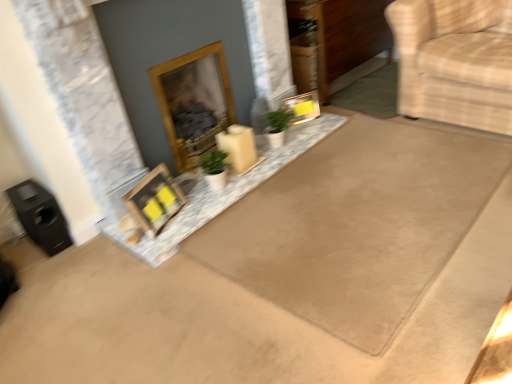
Question: Is beige fabric armchair at right outside wooden fireplace at center?

Choices:
 (A) yes
 (B) no

Answer: (A)

Question: Is beige fabric armchair at right at the left side of wooden fireplace at center?

Choices:
 (A) yes
 (B) no

Answer: (B)

Question: Would you consider beige fabric armchair at right to be distant from wooden fireplace at center?

Choices:
 (A) yes
 (B) no

Answer: (A)

Question: Does beige fabric armchair at right appear on the right side of wooden fireplace at center?

Choices:
 (A) no
 (B) yes

Answer: (B)

Question: From the image's perspective, is beige fabric armchair at right below wooden fireplace at center?

Choices:
 (A) yes
 (B) no

Answer: (B)

Question: Is beige fabric armchair at right oriented away from wooden fireplace at center?

Choices:
 (A) yes
 (B) no

Answer: (B)

Question: Is beige fabric armchair at right looking in the opposite direction of beige carpet at upper right, positioned as the 1th doormat in right-to-left order?

Choices:
 (A) no
 (B) yes

Answer: (A)

Question: Does beige fabric armchair at right have a lesser width compared to beige carpet at upper right, positioned as the 1th doormat in right-to-left order?

Choices:
 (A) no
 (B) yes

Answer: (A)

Question: Does beige fabric armchair at right come in front of beige carpet at upper right, which is the 2th doormat in left-to-right order?

Choices:
 (A) yes
 (B) no

Answer: (A)

Question: From a real-world perspective, is beige fabric armchair at right over beige carpet at upper right, positioned as the 1th doormat in right-to-left order?

Choices:
 (A) yes
 (B) no

Answer: (A)

Question: Does beige fabric armchair at right have a lesser height compared to beige carpet at upper right, which is the 2th doormat in left-to-right order?

Choices:
 (A) yes
 (B) no

Answer: (B)

Question: Is beige fabric armchair at right not near beige carpet at upper right, positioned as the 1th doormat in right-to-left order?

Choices:
 (A) yes
 (B) no

Answer: (B)

Question: From the image's perspective, is beige carpet at upper right, which is the 2th doormat in left-to-right order, above beige fabric armchair at right?

Choices:
 (A) no
 (B) yes

Answer: (A)